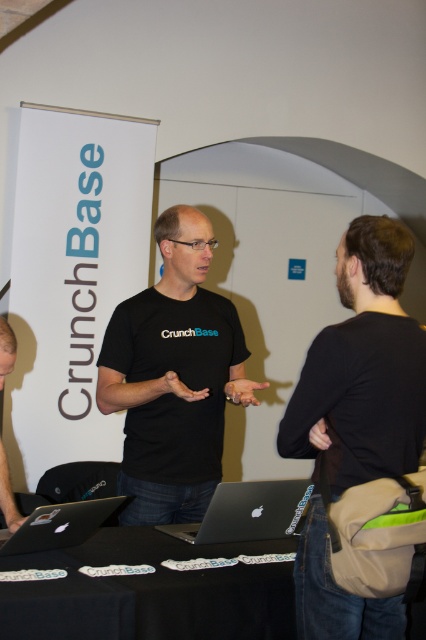
Is black matte t-shirt at center shorter than black matte table at center?

Incorrect, black matte t-shirt at center's height does not fall short of black matte table at center's.

Does point (121, 349) come in front of point (224, 579)?

No.

Does point (183, 419) come farther from viewer compared to point (124, 582)?

Yes, point (183, 419) is farther from viewer.

Locate an element on the screen. This screenshot has width=426, height=640. black matte t-shirt at center is located at coordinates (173, 378).

Which is above, silver metallic laptop at center or matte black t-shirt at center?

matte black t-shirt at center is higher up.

Is point (39, 531) in front of point (14, 528)?

That is True.

I want to click on silver metallic laptop at center, so click(x=60, y=524).

Does black matte laptop at center have a greater height compared to silver metallic laptop at center?

Correct, black matte laptop at center is much taller as silver metallic laptop at center.

Describe the element at coordinates (247, 512) in the screenshot. The height and width of the screenshot is (640, 426). I see `black matte laptop at center` at that location.

What do you see at coordinates (247, 512) in the screenshot? I see `black matte laptop at center` at bounding box center [247, 512].

Where is `black matte laptop at center`? This screenshot has width=426, height=640. black matte laptop at center is located at coordinates pyautogui.click(x=247, y=512).